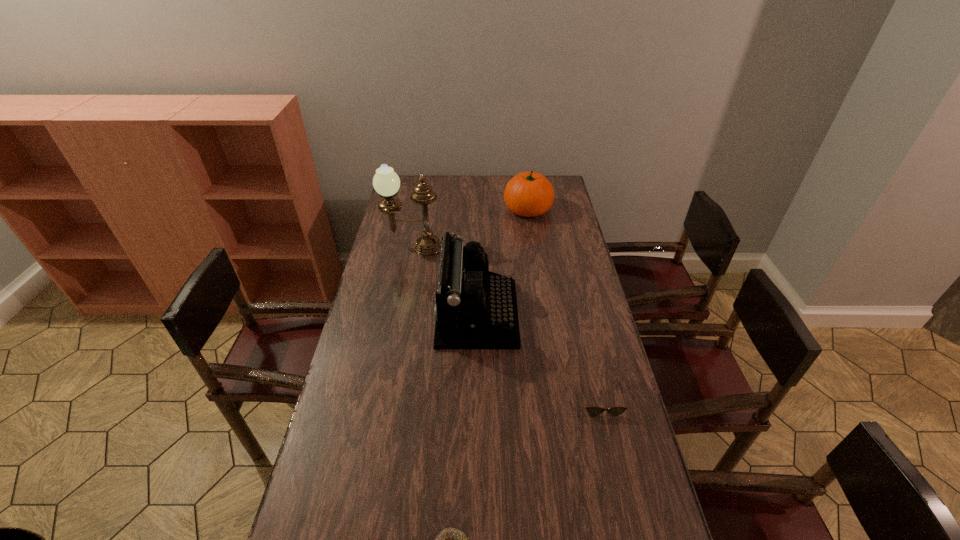
The width and height of the screenshot is (960, 540). Find the location of `vacant point located between the spectacles and the third nearest object`. vacant point located between the spectacles and the third nearest object is located at coordinates (539, 357).

The width and height of the screenshot is (960, 540). What are the coordinates of `free spot between the third shortest object and the third nearest object` in the screenshot? It's located at (502, 261).

Where is `free space between the third tallest object and the spectacles`? The width and height of the screenshot is (960, 540). free space between the third tallest object and the spectacles is located at coordinates (564, 305).

In order to click on vacant area between the pumpkin and the oil lamp in this screenshot , I will do `click(470, 228)`.

Point out which object is positioned as the fourth nearest to the leftmost object. Please provide its 2D coordinates. Your answer should be formatted as a tuple, i.e. [(x, y)], where the tuple contains the x and y coordinates of a point satisfying the conditions above.

[(450, 539)]

Locate an element on the screen. This screenshot has height=540, width=960. object that stands as the third closest to the second farthest object is located at coordinates (592, 411).

The width and height of the screenshot is (960, 540). I want to click on vacant space that satisfies the following two spatial constraints: 1. on the back side of the oil lamp; 2. on the left side of the pumpkin, so click(420, 209).